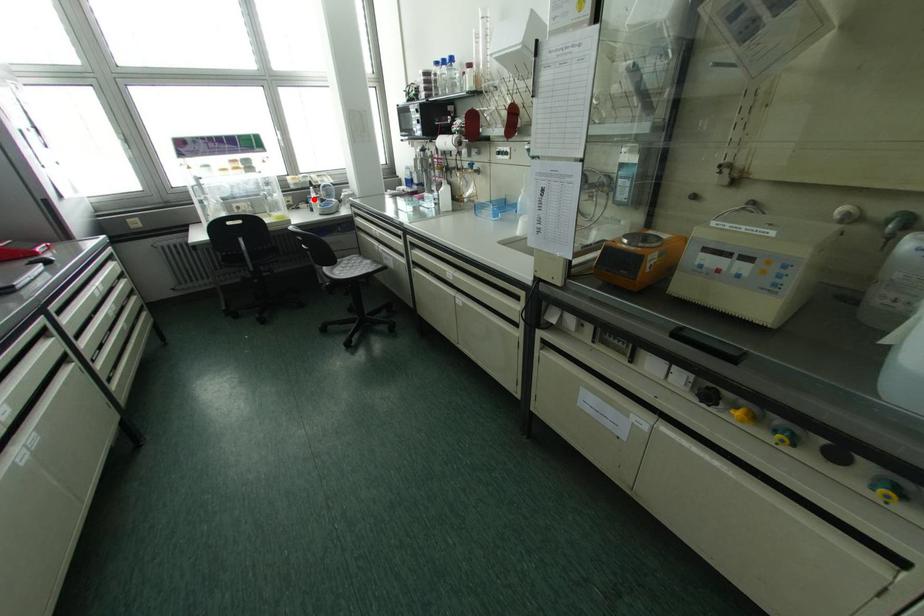
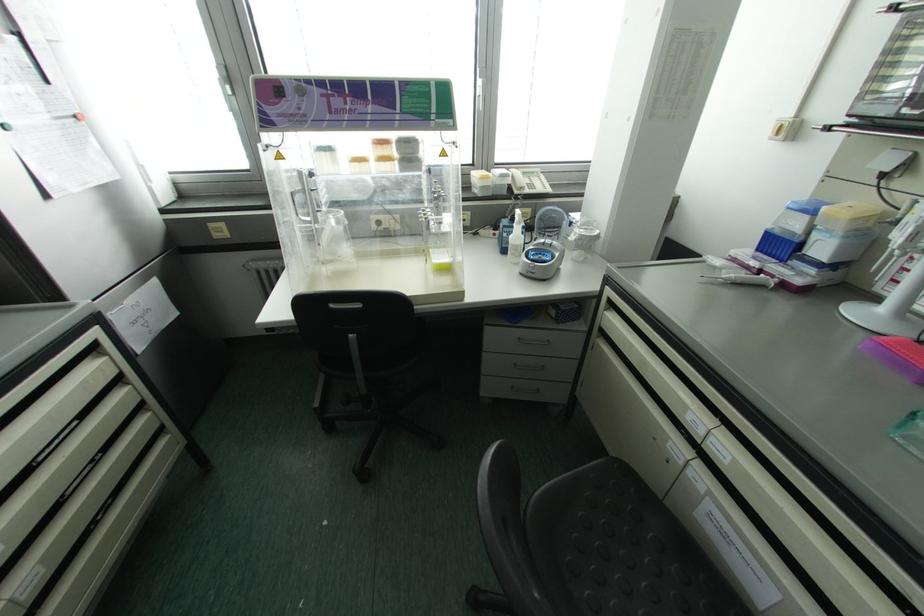
Question: I am providing you with two images of the same scene from different viewpoints. Given a red point in image1, look at the same physical point in image2. Is it:

Choices:
 (A) Closer to the viewpoint
 (B) Farther from the viewpoint

Answer: (B)